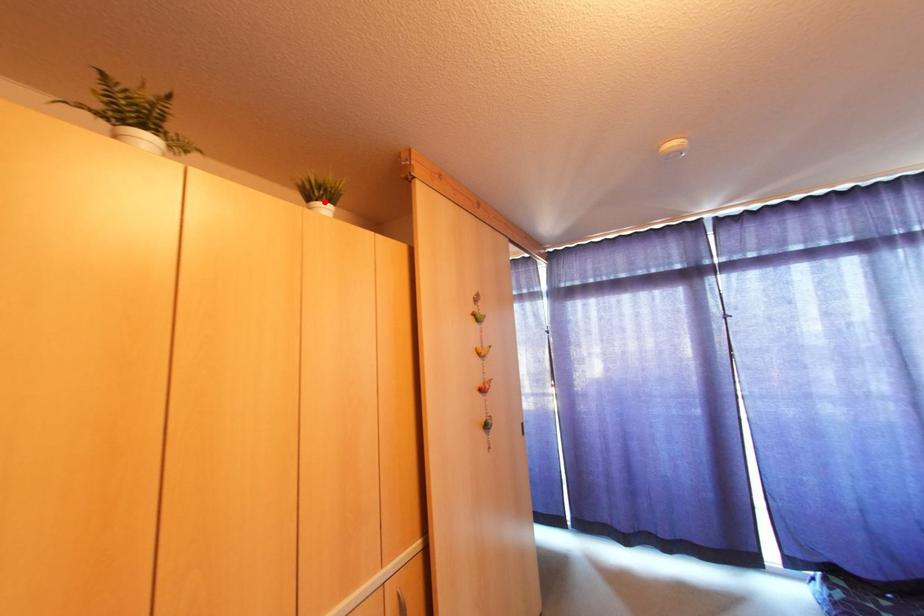
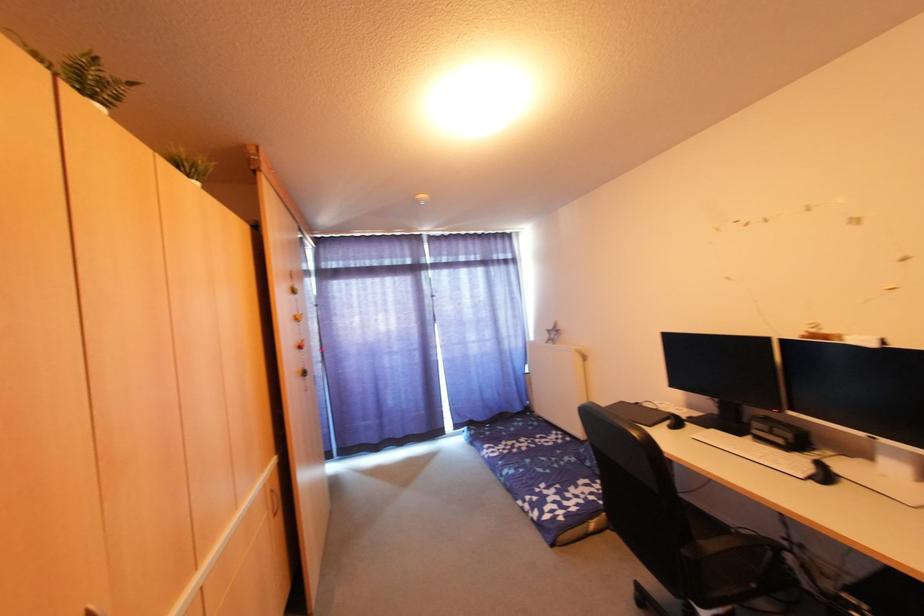
Find the pixel in the second image that matches the highlighted location in the first image.

(195, 180)